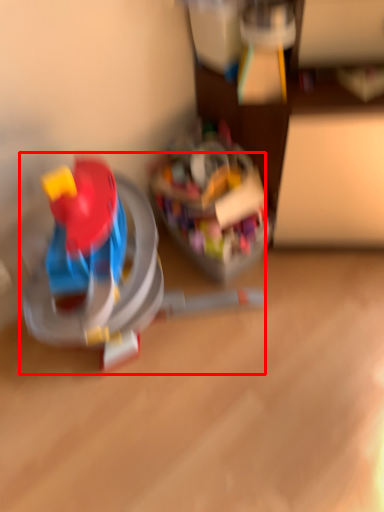
Question: From the image's perspective, what is the correct spatial positioning of toy (annotated by the red box) in reference to toy?

Choices:
 (A) below
 (B) above

Answer: (A)